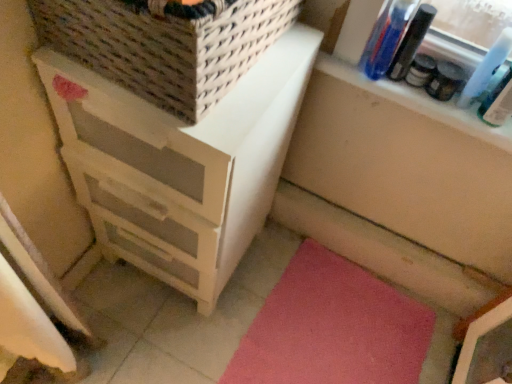
Question: Looking at their shapes, would you say clear plastic bottles at upper right is wider or thinner than white wood chest of drawers at left?

Choices:
 (A) thin
 (B) wide

Answer: (A)

Question: Visually, is clear plastic bottles at upper right positioned to the left or to the right of white wood chest of drawers at left?

Choices:
 (A) right
 (B) left

Answer: (A)

Question: Estimate the real-world distances between objects in this image. Which object is closer to the pink carpet at lower right?

Choices:
 (A) woven beige basket at upper left
 (B) clear plastic bottles at upper right
 (C) white wood chest of drawers at left

Answer: (C)

Question: Estimate the real-world distances between objects in this image. Which object is closer to the pink carpet at lower right?

Choices:
 (A) white wood chest of drawers at left
 (B) clear plastic bottles at upper right
 (C) woven beige basket at upper left

Answer: (A)